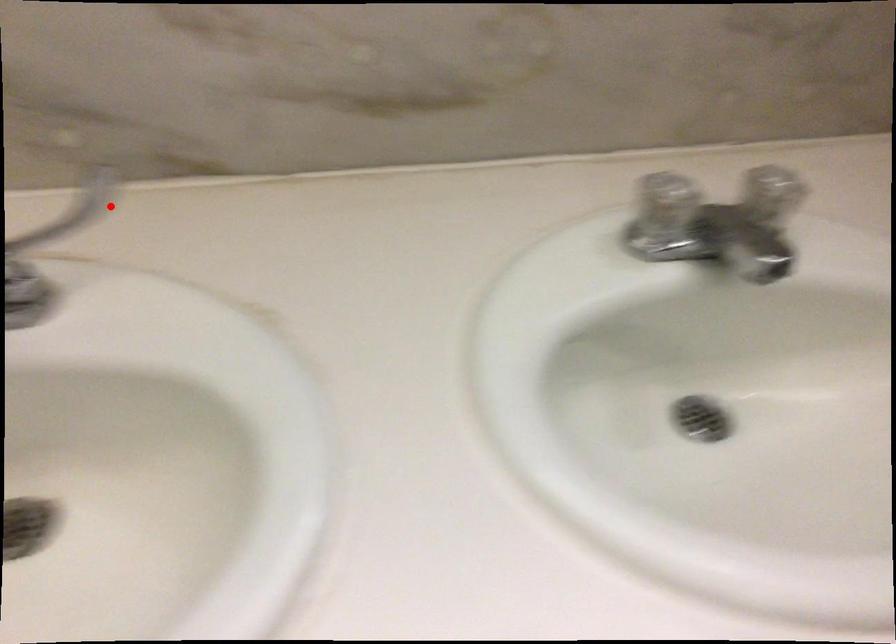
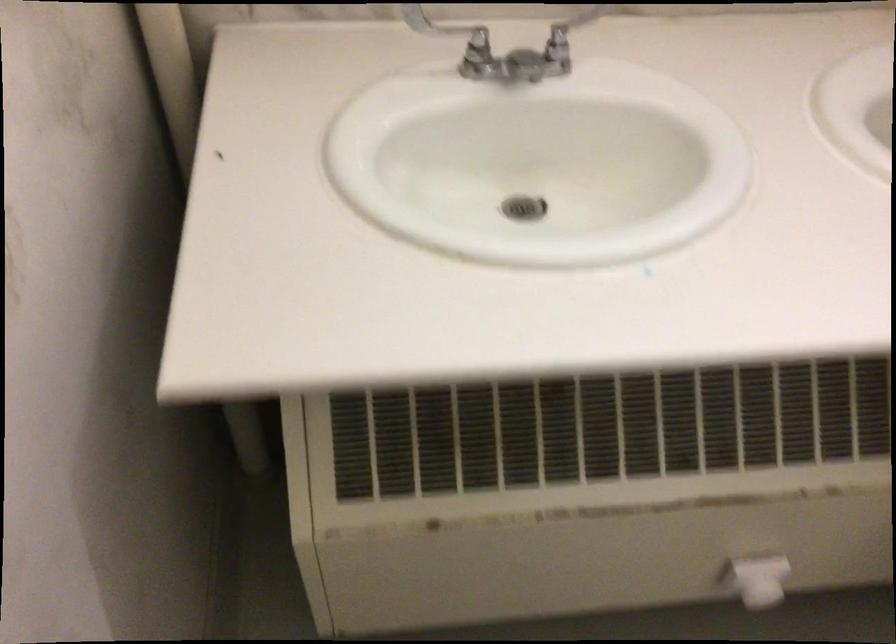
Find the pixel in the second image that matches the highlighted location in the first image.

(558, 33)